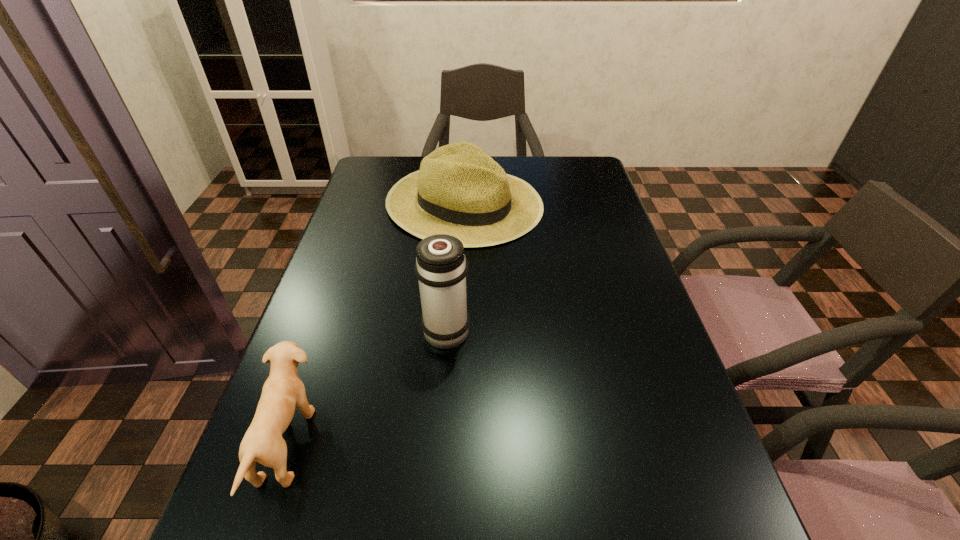
I want to click on vacant point located between the puppy and the farthest object, so click(376, 323).

Identify the location of object that is the second closest to the farthest object. (283, 390).

The width and height of the screenshot is (960, 540). In order to click on object identified as the second closest to the thermos bottle in this screenshot , I will do `click(460, 190)`.

You are a GUI agent. You are given a task and a screenshot of the screen. Output one action in this format:
    pyautogui.click(x=<x>, y=<y>)
    Task: Click on the vacant point that satisfies the following two spatial constraints: 1. on the side with the handle of the farthest object; 2. on the left side of the thermos bottle
    Image resolution: width=960 pixels, height=540 pixels.
    Given the screenshot: What is the action you would take?
    pyautogui.click(x=456, y=204)